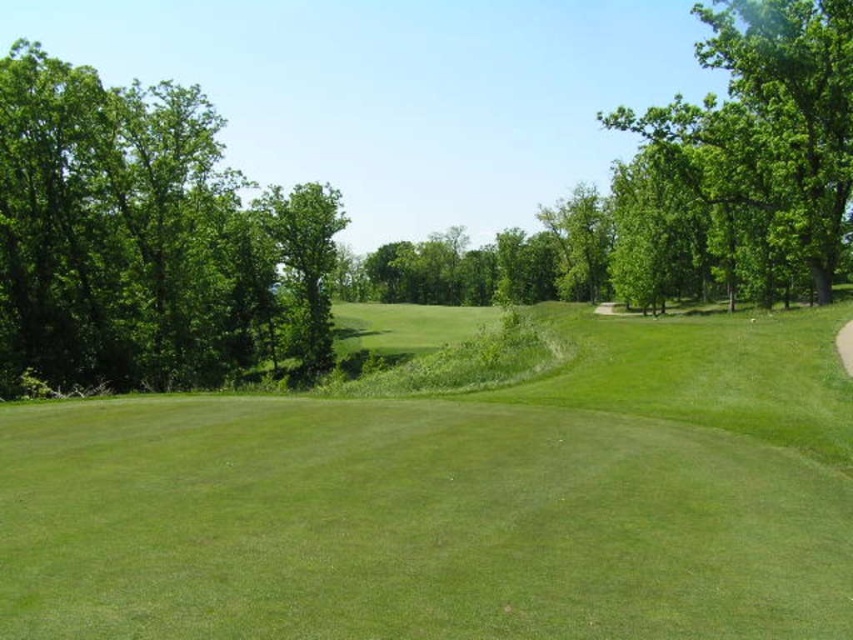
You are standing on the golf course and see the green grassy field at center and the green leafy tree at center. Which object is positioned to the right of the other?

The green grassy field at center is to the right of the green leafy tree at center.

You are a golfer standing at the tee, aiming to hit your ball onto the green grassy field at center. There is a green leafy tree at upper right that might obstruct your shot. Based on the distance between them, can you estimate whether your ball will clear the tree if you hit it straight towards the field?

The distance between the green grassy field at center and the green leafy tree at upper right is 36.87 meters. Since the tree is located at the upper right, it is positioned beyond the field. Therefore, if you aim straight for the field, your ball should land before reaching the tree, avoiding obstruction. However, this assumes typical shot distances and no additional factors like wind or elevation changes.

You are a golfer standing on the tee, looking towards the green grassy field at center and the green leafy tree at left. Which object is closer to you?

The green grassy field at center is closer to you because it is positioned below the green leafy tree at left, indicating it is in a lower elevation or closer plane.